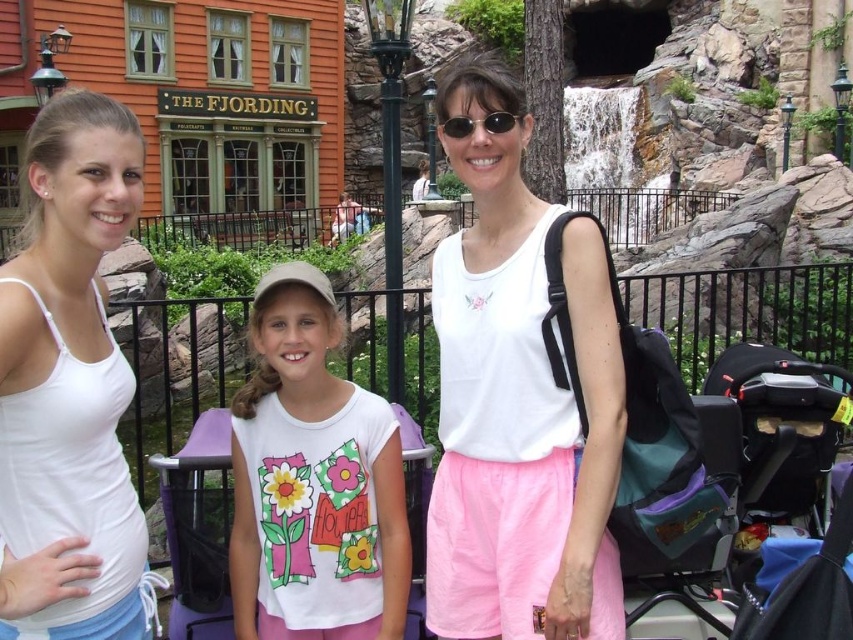
Question: Among these points, which one is nearest to the camera?

Choices:
 (A) (444, 115)
 (B) (447, 122)
 (C) (410, 630)

Answer: (C)

Question: Which object is the closest to the purple fabric stroller at center?

Choices:
 (A) white fabric tank top at left
 (B) black plastic sunglasses at center
 (C) white cotton shirt at center

Answer: (C)

Question: Which of the following is the farthest from the observer?

Choices:
 (A) purple fabric stroller at center
 (B) white fabric tank top at left
 (C) black plastic sunglasses at center
 (D) white cotton tank top at center

Answer: (C)

Question: Does white fabric tank top at left appear under purple fabric stroller at center?

Choices:
 (A) no
 (B) yes

Answer: (A)

Question: Is white fabric tank top at left bigger than white cotton shirt at center?

Choices:
 (A) yes
 (B) no

Answer: (B)

Question: Is white cotton tank top at center below white cotton shirt at center?

Choices:
 (A) yes
 (B) no

Answer: (B)